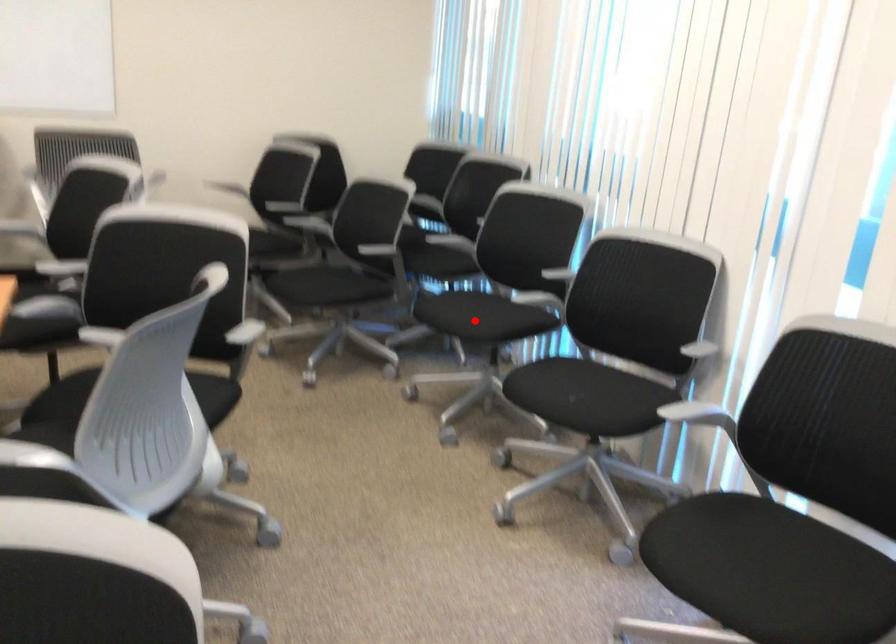
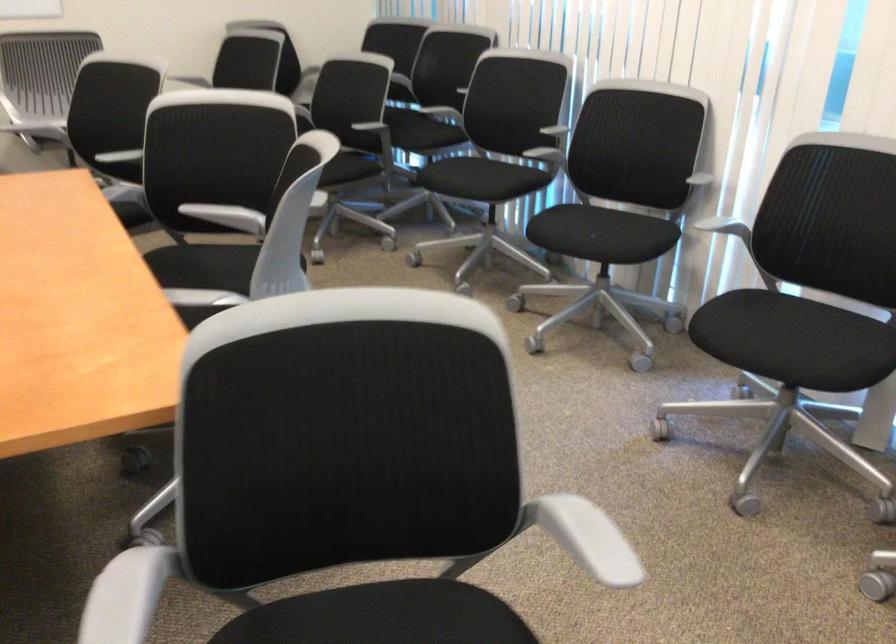
Question: I am providing you with two images of the same scene from different viewpoints. Given a red point in image1, look at the same physical point in image2. Is it:

Choices:
 (A) Closer to the viewpoint
 (B) Farther from the viewpoint

Answer: (B)